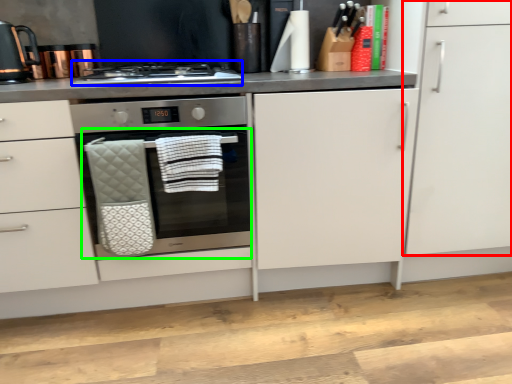
Question: Estimate the real-world distances between objects in this image. Which object is farther from cabinetry (highlighted by a red box), gas stove (highlighted by a blue box) or oven (highlighted by a green box)?

Choices:
 (A) gas stove
 (B) oven

Answer: (A)